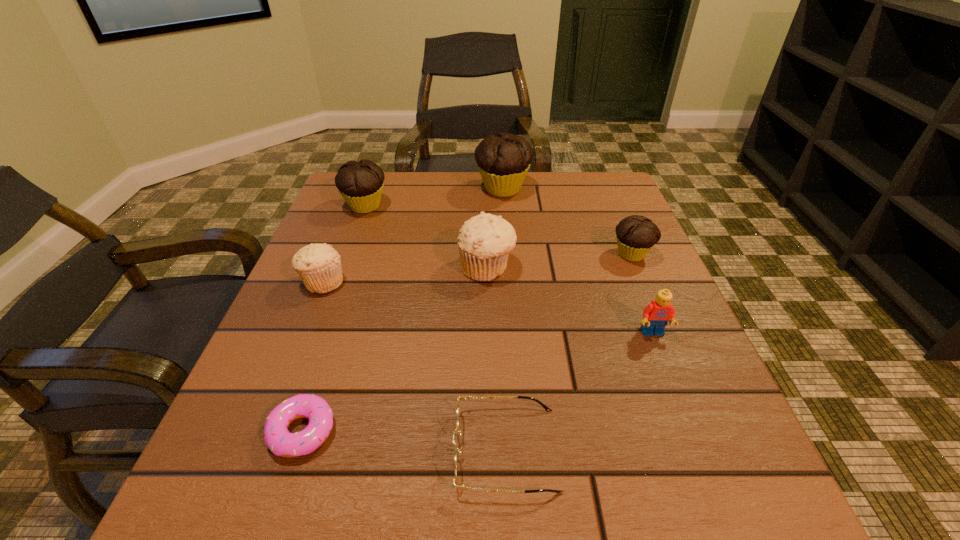
The height and width of the screenshot is (540, 960). I want to click on vacant space at the right edge of the desktop, so click(x=601, y=236).

At what (x,y) coordinates should I click in order to perform the action: click on vacant region at the near left corner of the desktop. Please return your answer as a coordinate pair (x, y). This screenshot has height=540, width=960. Looking at the image, I should click on coord(241,477).

Identify the location of vacant space at the far right corner. (617, 204).

This screenshot has height=540, width=960. What are the coordinates of `vacant space in between the rightmost chocolate muffin and the second chocolate muffin from right to left` in the screenshot? It's located at (567, 221).

At what (x,y) coordinates should I click in order to perform the action: click on free space between the smaller beige muffin and the leftmost chocolate muffin. Please return your answer as a coordinate pair (x, y). The width and height of the screenshot is (960, 540). Looking at the image, I should click on (345, 244).

The height and width of the screenshot is (540, 960). Identify the location of vacant area between the green spectacles and the sixth farthest object. (579, 391).

At what (x,y) coordinates should I click in order to perform the action: click on free space between the leftmost chocolate muffin and the second chocolate muffin from right to left. Please return your answer as a coordinate pair (x, y). The height and width of the screenshot is (540, 960). Looking at the image, I should click on tap(434, 197).

The width and height of the screenshot is (960, 540). In order to click on free spot between the biggest chocolate muffin and the third nearest object in this screenshot , I will do `click(578, 261)`.

Image resolution: width=960 pixels, height=540 pixels. In order to click on blank region between the bigger beige muffin and the shortest object in this screenshot , I will do `click(395, 349)`.

You are a GUI agent. You are given a task and a screenshot of the screen. Output one action in this format:
    pyautogui.click(x=<x>, y=<y>)
    Task: Click on the blank region between the bigger beige muffin and the second biggest chocolate muffin
    Image resolution: width=960 pixels, height=540 pixels.
    Given the screenshot: What is the action you would take?
    click(x=426, y=237)